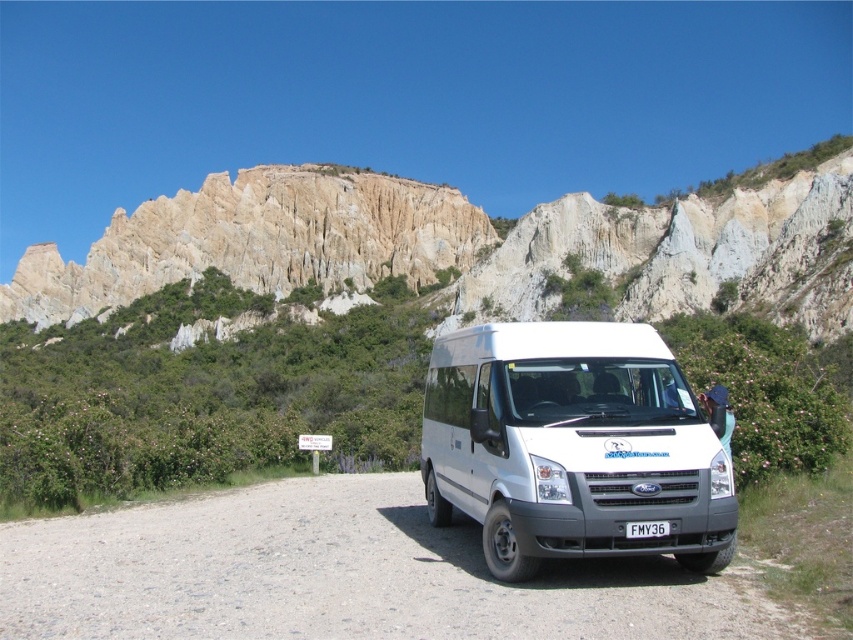
Can you confirm if rustic stone cliff at upper center is positioned to the left of white matte van at center?

Correct, you'll find rustic stone cliff at upper center to the left of white matte van at center.

Between rustic stone cliff at upper center and white matte van at center, which one is positioned higher?

rustic stone cliff at upper center is higher up.

Between point (115, 269) and point (502, 362), which one is positioned behind?

The point (115, 269) is more distant.

This screenshot has height=640, width=853. What are the coordinates of `rustic stone cliff at upper center` in the screenshot? It's located at (471, 244).

Is point (338, 624) positioned in front of point (688, 536)?

Yes, it is in front of point (688, 536).

Does gray gravel road at center have a lesser height compared to white matte van at center?

Yes, gray gravel road at center is shorter than white matte van at center.

I want to click on gray gravel road at center, so click(x=346, y=577).

Who is positioned more to the left, rustic stone cliff at upper center or gray gravel road at center?

rustic stone cliff at upper center is more to the left.

I want to click on rustic stone cliff at upper center, so click(x=471, y=244).